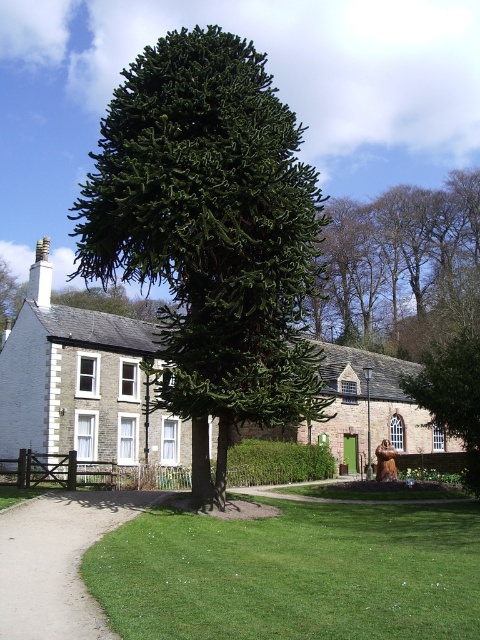
You are standing in the middle of the scene and want to walk towards the green grass at center. Which direction should you move relative to the green textured tree at center?

Since the green textured tree at center is positioned on the left side of the green grass at center, you should move to the right of the green textured tree at center to reach the green grass at center.

You are planning to place a small garden bench in this outdoor scene. The bench requires a space wider than the green grass at center. Can you place the bench next to the green textured tree at center?

The green textured tree at center is wider than the green grass at center. Since the bench needs a space wider than the grass, the area next to the tree is suitable for placing the bench.

You are a gardener planning to plant a new flower bed. You have a limited amount of soil that can cover an area equal to the size of the smooth gravel path at lower left. Can you use this soil to cover the entire area occupied by the green leafy tree at center?

The smooth gravel path at lower left occupies less space than the green leafy tree at center, so the soil available is insufficient to cover the entire area of the green leafy tree at center.